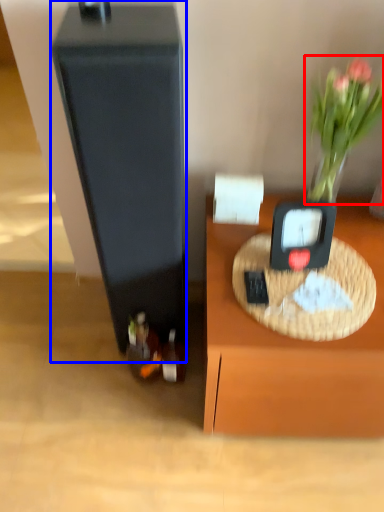
Question: Which object appears farthest to the camera in this image, plant (highlighted by a red box) or wide (highlighted by a blue box)?

Choices:
 (A) plant
 (B) wide

Answer: (A)